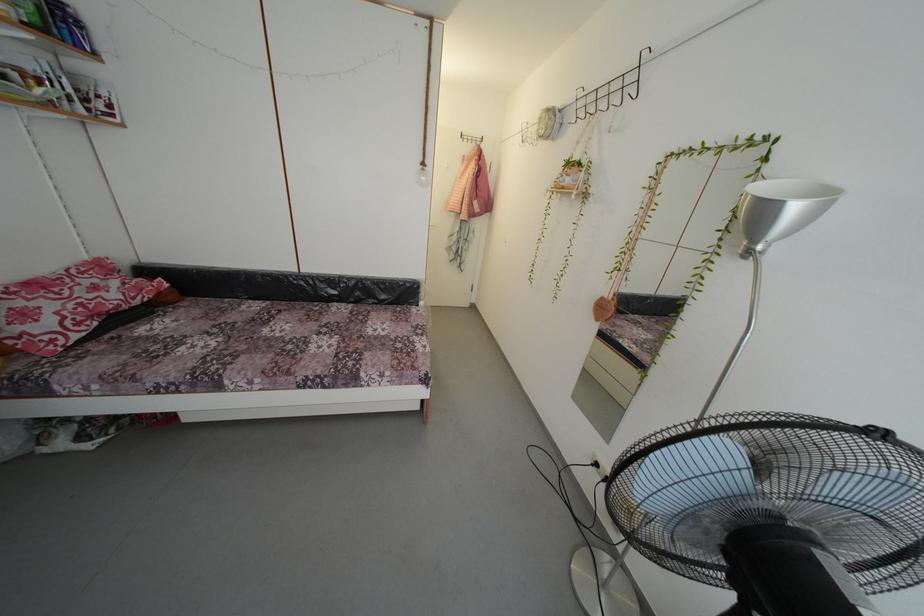
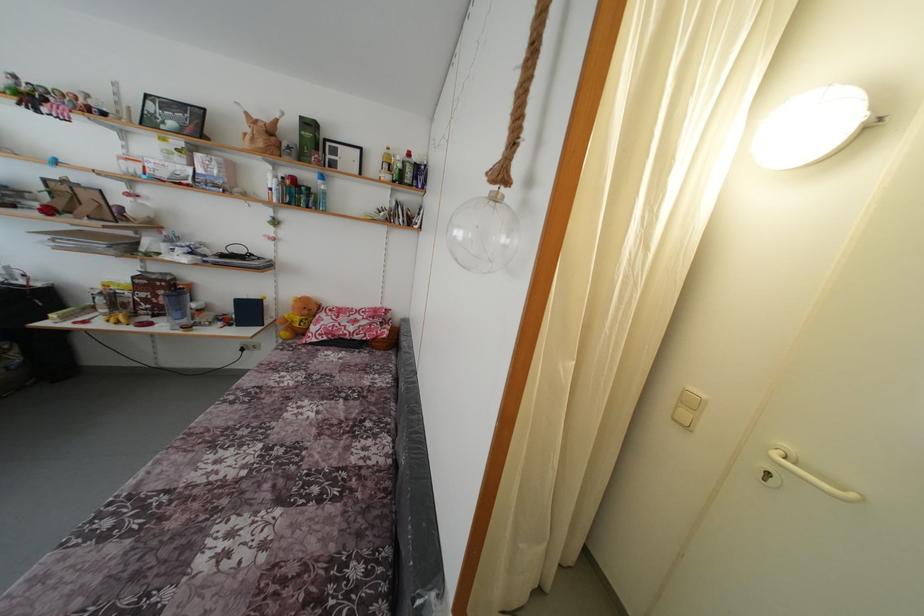
Where in the second image is the point corresponding to pixel 34 306 from the first image?

(332, 321)